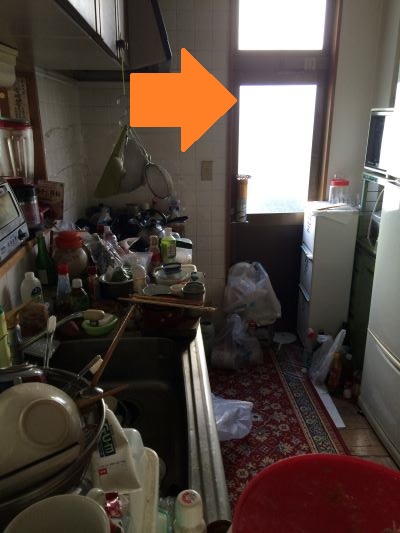
The width and height of the screenshot is (400, 533). Find the location of `dishes`. dishes is located at coordinates (69, 398).